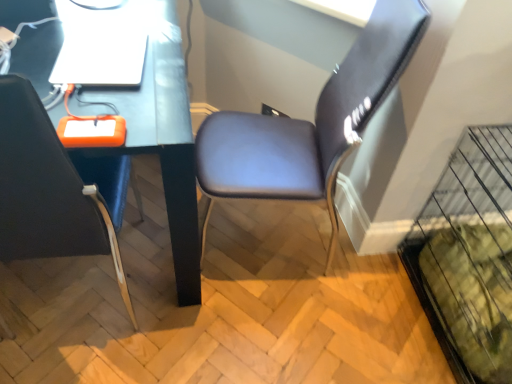
Locate an element on the screen. empty space that is to the right of white glossy laptop at upper left is located at coordinates (158, 65).